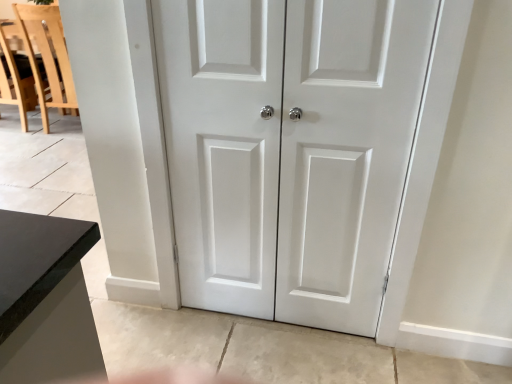
What is the approximate width of white matte door at center?

1.09 inches.

At what (x,y) coordinates should I click in order to perform the action: click on white matte door at center. Please return your answer as a coordinate pair (x, y). Looking at the image, I should click on [290, 150].

Where is `light wood chair at left`? This screenshot has width=512, height=384. light wood chair at left is located at coordinates (47, 57).

How different are the orientations of white matte door at center and light wood chair at left in degrees?

They differ by 179 degrees in their facing directions.

Which object is more forward, white matte door at center or light wood chair at left?

white matte door at center.

Locate an element on the screen. The height and width of the screenshot is (384, 512). door in front of the light wood chair at left is located at coordinates (290, 150).

Which of these two, light wood chair at left or white matte door at center, is bigger?

light wood chair at left is bigger.

In terms of width, does light wood chair at left look wider or thinner when compared to white matte door at center?

light wood chair at left is wider than white matte door at center.

Is light wood chair at left inside the boundaries of white matte door at center, or outside?

light wood chair at left cannot be found inside white matte door at center.

Are white matte door at center and white matte door at center located far from each other?

Actually, white matte door at center and white matte door at center are a little close together.

In the image, is white matte door at center positioned in front of or behind white matte door at center?

white matte door at center is positioned closer to the viewer than white matte door at center.

Locate an element on the screen. The image size is (512, 384). door that is on the right side of white matte door at center is located at coordinates (290, 150).

Consider the image. Considering the relative sizes of white matte door at center and white matte door at center in the image provided, is white matte door at center shorter than white matte door at center?

No, white matte door at center is not shorter than white matte door at center.

Is light wood chair at left oriented away from white matte door at center?

light wood chair at left does not have its back to white matte door at center.

Is light wood chair at left wider than white matte door at center?

Correct, the width of light wood chair at left exceeds that of white matte door at center.

Find the location of a particular element. chair located above the white matte door at center (from the image's perspective) is located at coordinates (47, 57).

Looking at this image, how different are the orientations of white matte door at center and light wood chair at left in degrees?

There is a 178-degree angle between the facing directions of white matte door at center and light wood chair at left.

Which object is wider, white matte door at center or light wood chair at left?

With larger width is light wood chair at left.

Does white matte door at center have a larger size compared to light wood chair at left?

No.

Could you tell me if white matte door at center is facing light wood chair at left?

No, white matte door at center is not aimed at light wood chair at left.

Which object is further away from the camera taking this photo, white matte door at center or white matte door at center?

white matte door at center is more distant.

Based on the photo, from a real-world perspective, is white matte door at center above or below white matte door at center?

white matte door at center is above white matte door at center.

Can you confirm if white matte door at center is shorter than white matte door at center?

Indeed, white matte door at center has a lesser height compared to white matte door at center.

Find the location of `door above the light wood chair at left (from a real-world perspective)`. door above the light wood chair at left (from a real-world perspective) is located at coordinates (290, 150).

Where is `screen door below the light wood chair at left (from the image's perspective)`? The width and height of the screenshot is (512, 384). screen door below the light wood chair at left (from the image's perspective) is located at coordinates (223, 146).

Based on their spatial positions, is white matte door at center or white matte door at center further from light wood chair at left?

white matte door at center.

Looking at the image, which one is located closer to white matte door at center, light wood chair at left or white matte door at center?

white matte door at center is closer to white matte door at center.

Considering their positions, is white matte door at center positioned further to light wood chair at left than white matte door at center?

Based on the image, white matte door at center appears to be further to light wood chair at left.

Based on their spatial positions, is light wood chair at left or white matte door at center closer to white matte door at center?

Among the two, white matte door at center is located nearer to white matte door at center.

From the image, which object appears to be farther from white matte door at center, white matte door at center or light wood chair at left?

The object further to white matte door at center is light wood chair at left.

Based on their spatial positions, is white matte door at center or light wood chair at left closer to white matte door at center?

white matte door at center is closer to white matte door at center.

Where is `screen door located between white matte door at center and light wood chair at left in the depth direction`? This screenshot has width=512, height=384. screen door located between white matte door at center and light wood chair at left in the depth direction is located at coordinates (223, 146).